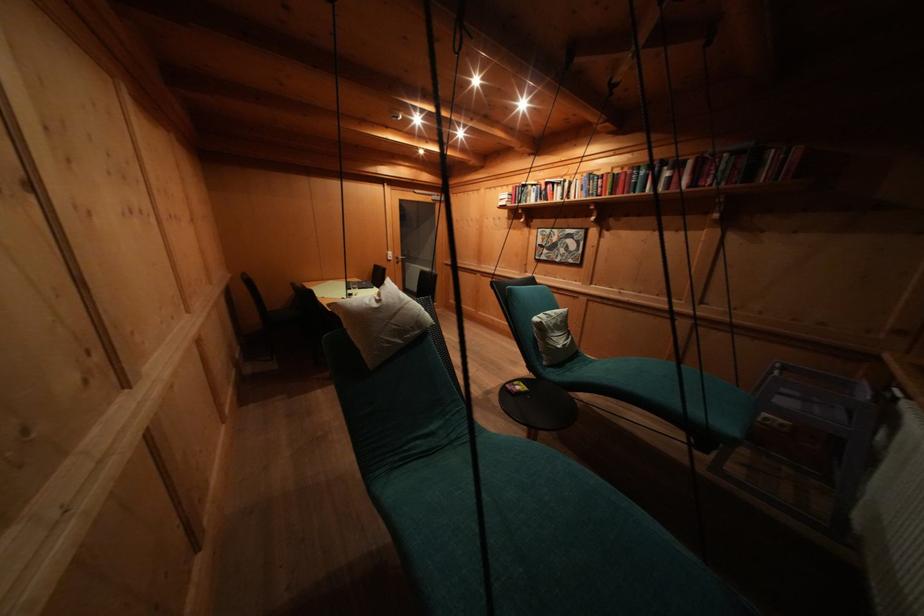
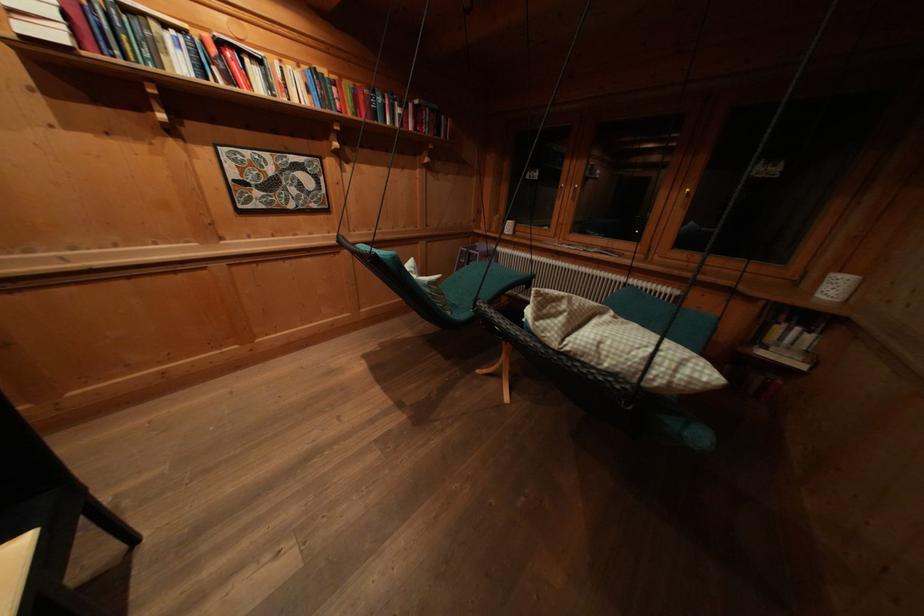
In the second image, find the point that corresponds to (649,177) in the first image.

(385, 103)